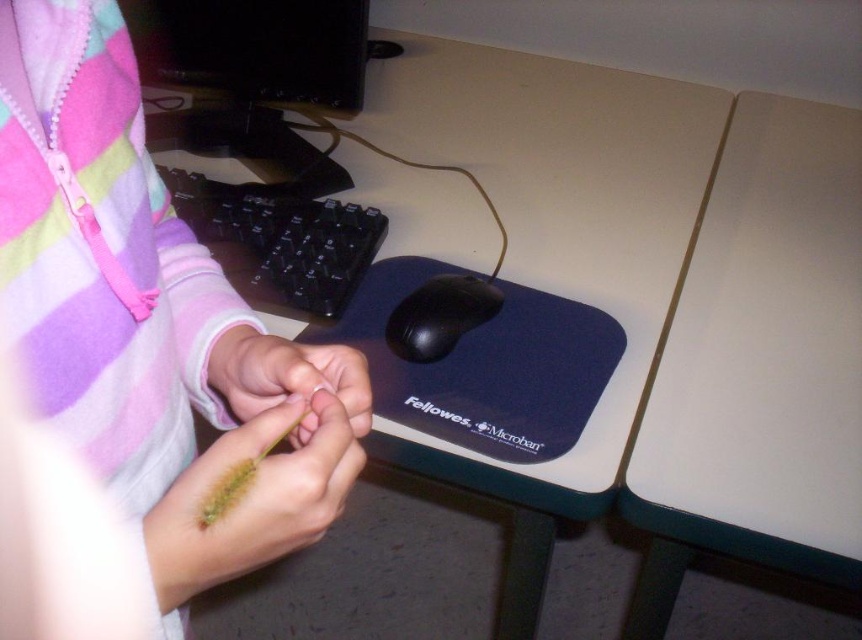
Can you confirm if white plastic table at center is shorter than white matte table at upper right?

Incorrect, white plastic table at center's height does not fall short of white matte table at upper right's.

Which is below, white plastic table at center or white matte table at upper right?

white matte table at upper right is below.

Locate an element on the screen. The image size is (862, 640). white plastic table at center is located at coordinates (556, 220).

Does point (239, 157) lie behind point (203, 470)?

That is True.

Between point (183, 8) and point (248, 564), which one is positioned in front?

Point (248, 564) is more forward.

You are a GUI agent. You are given a task and a screenshot of the screen. Output one action in this format:
    pyautogui.click(x=<x>, y=<y>)
    Task: Click on the black plastic monitor at upper left
    Image resolution: width=862 pixels, height=640 pixels.
    Given the screenshot: What is the action you would take?
    pyautogui.click(x=253, y=80)

Is white plastic table at center shorter than black rubber mouse at center?

In fact, white plastic table at center may be taller than black rubber mouse at center.

Based on the photo, between white plastic table at center and black rubber mouse at center, which one is positioned higher?

white plastic table at center

Between point (611, 401) and point (436, 340), which one is positioned in front?

Point (436, 340)

This screenshot has height=640, width=862. I want to click on white plastic table at center, so click(x=556, y=220).